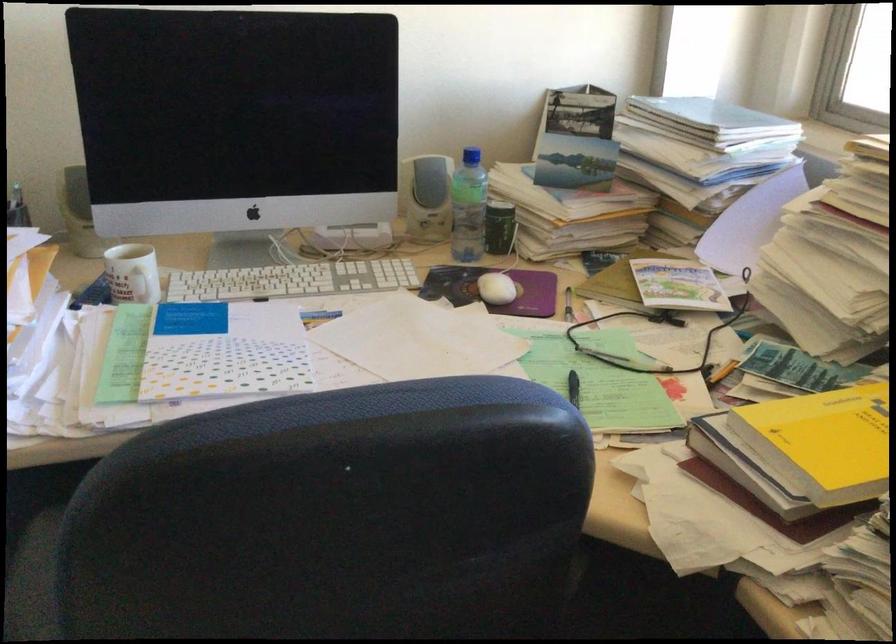
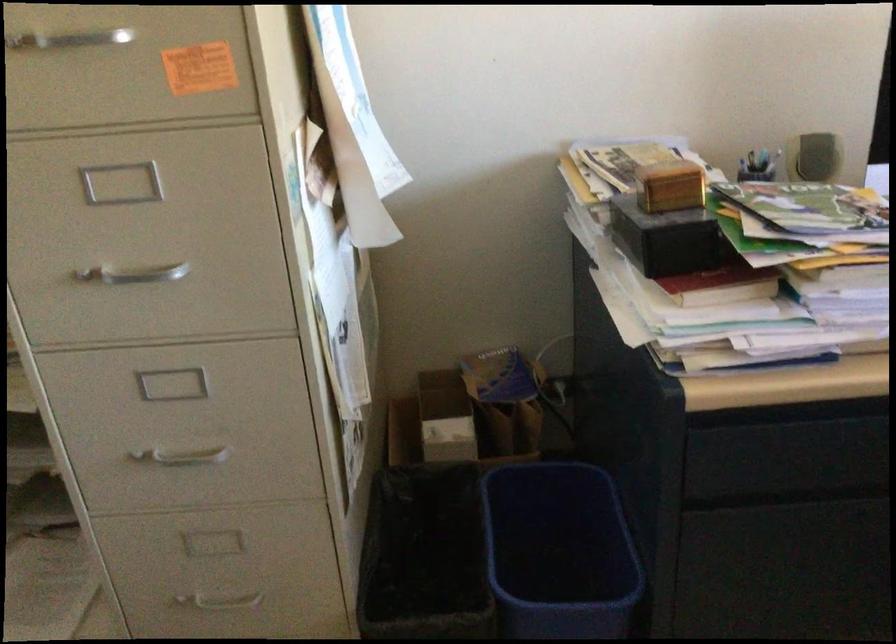
Question: The images are taken continuously from a first-person perspective. In which direction is your viewpoint rotating?

Choices:
 (A) Left
 (B) Right
 (C) Up
 (D) Down

Answer: (A)